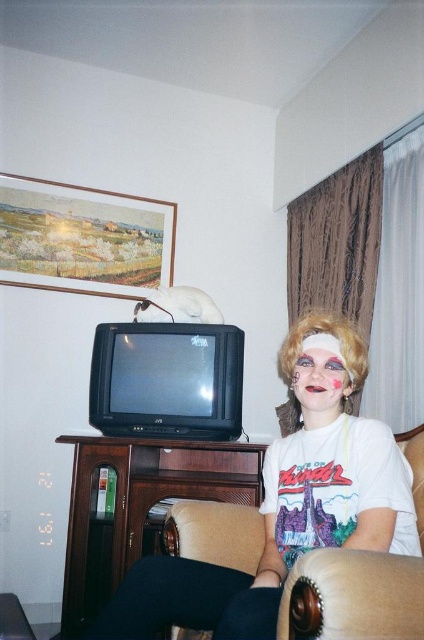
Describe the element at coordinates (331, 337) in the screenshot. I see `blonde synthetic wig at center` at that location.

I want to click on blonde synthetic wig at center, so click(x=331, y=337).

The image size is (424, 640). I want to click on blonde synthetic wig at center, so click(331, 337).

Which of these two, white matte wig at upper center or blonde synthetic wig at center, stands taller?

white matte wig at upper center

Who is more distant from viewer, (122, 620) or (309, 312)?

Point (309, 312)

Describe the element at coordinates (287, 506) in the screenshot. I see `white matte wig at upper center` at that location.

I want to click on white matte wig at upper center, so click(x=287, y=506).

Between white matte wig at upper center and matte pink makeup at center, which one appears on the right side from the viewer's perspective?

From the viewer's perspective, matte pink makeup at center appears more on the right side.

This screenshot has height=640, width=424. In order to click on white matte wig at upper center in this screenshot , I will do `click(287, 506)`.

You are a GUI agent. You are given a task and a screenshot of the screen. Output one action in this format:
    pyautogui.click(x=<x>, y=<y>)
    Task: Click on the white matte wig at upper center
    The width and height of the screenshot is (424, 640).
    Given the screenshot: What is the action you would take?
    coord(287,506)